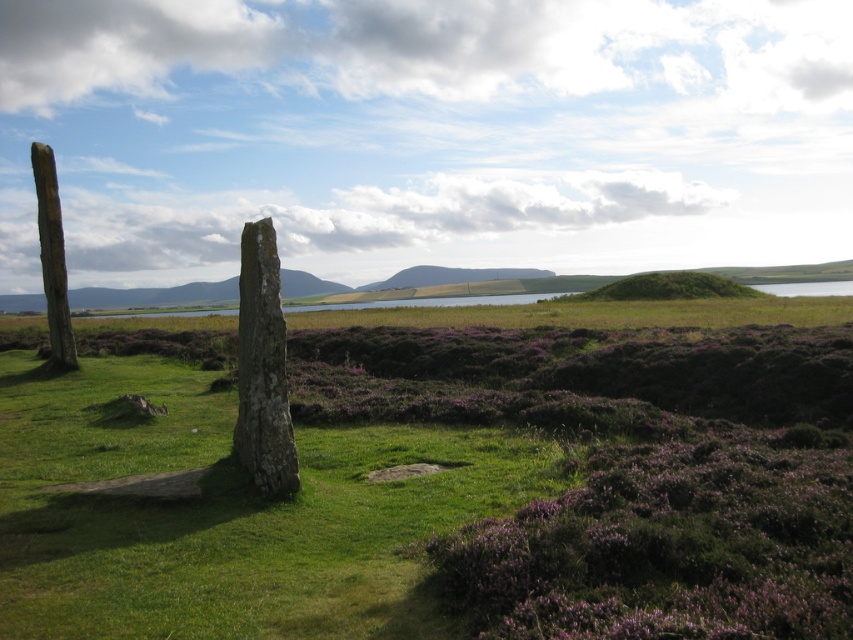
You are a hiker who wants to place a small flag exactly halfway between the green mossy stone at center and the smooth wooden pole at left. Based on their positions, where should you place the flag?

The green mossy stone at center is located below the smooth wooden pole at left, so placing the flag halfway between them would require positioning it in the middle of the vertical space between the two objects.

You are a gardener planning to plant flowers between the green grassy at center and the green mossy stone at center. Which area has more space available for planting?

The green grassy at center is larger in size than the green mossy stone at center, so there is more space available for planting in the green grassy at center area.